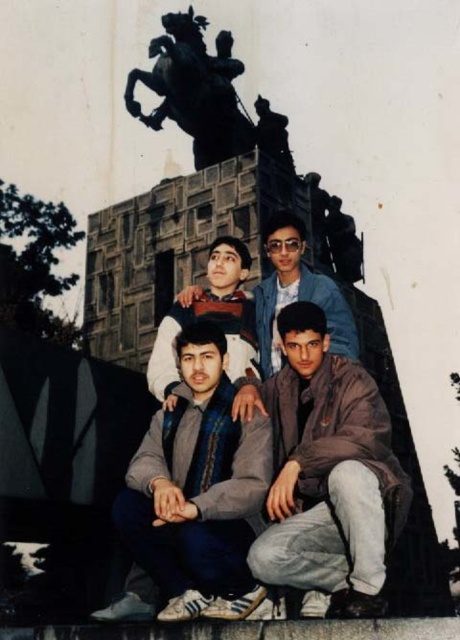
You are standing at the viewpoint of the image and want to know how far the point at coordinates (122, 506) is from you. Can you determine the distance?

The distance between the point at coordinates (122, 506) and the viewer is 41.46 meters.